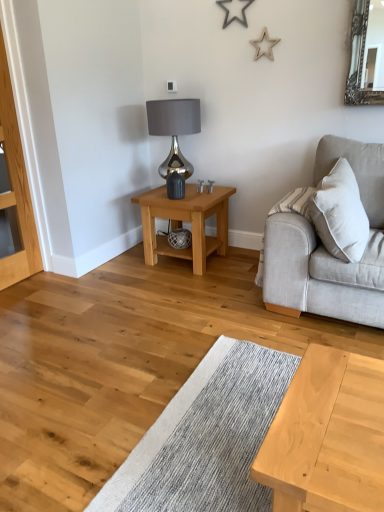
What do you see at coordinates (174, 138) in the screenshot? I see `satin silver lamp at upper center` at bounding box center [174, 138].

Where is `light oak dresser at left`? The image size is (384, 512). light oak dresser at left is located at coordinates (x=16, y=186).

Is light oak dresser at left situated inside light brown wooden table at center or outside?

A: light oak dresser at left is spatially situated outside light brown wooden table at center.

Is light oak dresser at left shorter than light brown wooden table at center?

No, light oak dresser at left is not shorter than light brown wooden table at center.

What are the coordinates of `table that is on the right side of light oak dresser at left` in the screenshot? It's located at (186, 221).

Considering the points (10, 178) and (161, 251), which point is in front, point (10, 178) or point (161, 251)?

The point (10, 178) is in front.

Considering the relative positions of light brown wooden table at center and satin silver lamp at upper center in the image provided, is light brown wooden table at center to the right of satin silver lamp at upper center from the viewer's perspective?

Yes, light brown wooden table at center is to the right of satin silver lamp at upper center.

There is a light brown wooden table at center. Where is `table lamp above it (from a real-world perspective)`? The image size is (384, 512). table lamp above it (from a real-world perspective) is located at coordinates point(174,138).

Is light brown wooden table at center positioned behind satin silver lamp at upper center?

No, the depth of light brown wooden table at center is less than that of satin silver lamp at upper center.

Which is closer to the camera, (376, 159) or (164, 174)?

Point (376, 159) appears to be closer to the viewer than point (164, 174).

Where is `table lamp above the light gray fabric couch at right (from the image's perspective)`? table lamp above the light gray fabric couch at right (from the image's perspective) is located at coordinates (174, 138).

Is light gray fabric couch at right turned away from satin silver lamp at upper center?

No, light gray fabric couch at right is not facing away from satin silver lamp at upper center.

From a real-world perspective, which object stands above the other?

satin silver lamp at upper center, from a real-world perspective.

How many degrees apart are the facing directions of satin silver lamp at upper center and light oak dresser at left?

The facing directions of satin silver lamp at upper center and light oak dresser at left are 42.6 degrees apart.

This screenshot has height=512, width=384. I want to click on table lamp beneath the light oak dresser at left (from a real-world perspective), so click(174, 138).

In the image, is satin silver lamp at upper center on the left side or the right side of light oak dresser at left?

Clearly, satin silver lamp at upper center is on the right of light oak dresser at left in the image.

Considering the positions of point (194, 117) and point (20, 225), is point (194, 117) closer or farther from the camera than point (20, 225)?

Point (194, 117) is farther from the camera than point (20, 225).

Which is more to the left, light gray fabric couch at right or light brown wooden table at center?

light brown wooden table at center.

Considering the relative sizes of light gray fabric couch at right and light brown wooden table at center in the image provided, is light gray fabric couch at right bigger than light brown wooden table at center?

Yes.

From their relative heights in the image, would you say light gray fabric couch at right is taller or shorter than light brown wooden table at center?

light gray fabric couch at right is taller than light brown wooden table at center.

Is light brown wooden table at center surrounding light gray fabric couch at right?

No, light gray fabric couch at right is not a part of light brown wooden table at center.

Considering the relative sizes of light brown wooden table at center and light gray fabric couch at right in the image provided, is light brown wooden table at center shorter than light gray fabric couch at right?

Correct, light brown wooden table at center is not as tall as light gray fabric couch at right.

Is point (186, 252) farther from viewer compared to point (351, 279)?

Yes, it is.

How different are the orientations of light brown wooden table at center and light gray fabric couch at right in degrees?

90.1 degrees separate the facing orientations of light brown wooden table at center and light gray fabric couch at right.

From the image's perspective, between satin silver lamp at upper center and light brown wooden table at center, who is located below?

light brown wooden table at center, from the image's perspective.

Looking at this image, is satin silver lamp at upper center looking in the opposite direction of light brown wooden table at center?

That's not correct — satin silver lamp at upper center is not looking away from light brown wooden table at center.

Considering the relative positions of satin silver lamp at upper center and light brown wooden table at center in the image provided, is satin silver lamp at upper center to the left of light brown wooden table at center from the viewer's perspective?

Indeed, satin silver lamp at upper center is positioned on the left side of light brown wooden table at center.

Between satin silver lamp at upper center and light brown wooden table at center, which one has smaller width?

With smaller width is satin silver lamp at upper center.

You are a GUI agent. You are given a task and a screenshot of the screen. Output one action in this format:
    pyautogui.click(x=<x>, y=<y>)
    Task: Click on the table below the light oak dresser at left (from the image's perspective)
    The height and width of the screenshot is (512, 384).
    Given the screenshot: What is the action you would take?
    pyautogui.click(x=186, y=221)

At what (x,y) coordinates should I click in order to perform the action: click on table in front of the satin silver lamp at upper center. Please return your answer as a coordinate pair (x, y). This screenshot has height=512, width=384. Looking at the image, I should click on (186, 221).

When comparing their distances from light oak dresser at left, does light gray fabric couch at right or satin silver lamp at upper center seem further?

light gray fabric couch at right.

From the image, which object appears to be nearer to light oak dresser at left, light gray fabric couch at right or light brown wooden table at center?

light brown wooden table at center lies closer to light oak dresser at left than the other object.

Which object lies further to the anchor point light gray fabric couch at right, satin silver lamp at upper center or light oak dresser at left?

light oak dresser at left is positioned further to the anchor light gray fabric couch at right.

Considering their positions, is satin silver lamp at upper center positioned closer to light brown wooden table at center than light oak dresser at left?

satin silver lamp at upper center is closer to light brown wooden table at center.

When comparing their distances from satin silver lamp at upper center, does light oak dresser at left or light gray fabric couch at right seem further?

light gray fabric couch at right.

Which object lies nearer to the anchor point light brown wooden table at center, satin silver lamp at upper center or light gray fabric couch at right?

satin silver lamp at upper center is closer to light brown wooden table at center.

Estimate the real-world distances between objects in this image. Which object is closer to light gray fabric couch at right, light brown wooden table at center or satin silver lamp at upper center?

Based on the image, light brown wooden table at center appears to be nearer to light gray fabric couch at right.

When comparing their distances from light gray fabric couch at right, does satin silver lamp at upper center or light brown wooden table at center seem closer?

Based on the image, light brown wooden table at center appears to be nearer to light gray fabric couch at right.

This screenshot has width=384, height=512. I want to click on table lamp between light oak dresser at left and light brown wooden table at center, so click(174, 138).

What are the coordinates of `table between light oak dresser at left and light gray fabric couch at right` in the screenshot? It's located at (186, 221).

I want to click on table lamp between light oak dresser at left and light gray fabric couch at right in the horizontal direction, so click(174, 138).

Find the location of a particular element. The width and height of the screenshot is (384, 512). table between satin silver lamp at upper center and light gray fabric couch at right in the horizontal direction is located at coordinates (186, 221).